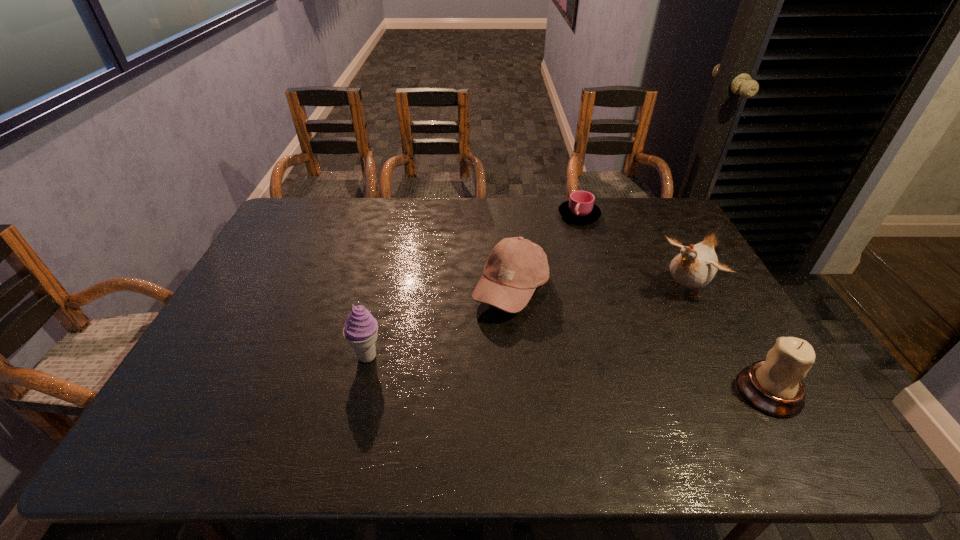
Locate an element on the screen. The height and width of the screenshot is (540, 960). vacant space that satisfies the following two spatial constraints: 1. on the front side of the farthest object; 2. on the right side of the candle holder is located at coordinates (634, 392).

Image resolution: width=960 pixels, height=540 pixels. I want to click on free space that satisfies the following two spatial constraints: 1. on the back side of the farthest object; 2. on the left side of the baseball cap, so click(505, 215).

At what (x,y) coordinates should I click in order to perform the action: click on vacant position in the image that satisfies the following two spatial constraints: 1. on the front side of the farthest object; 2. on the right side of the candle holder. Please return your answer as a coordinate pair (x, y). Image resolution: width=960 pixels, height=540 pixels. Looking at the image, I should click on (634, 392).

Find the location of a particular element. blank space that satisfies the following two spatial constraints: 1. on the back side of the leftmost object; 2. on the right side of the bird is located at coordinates (384, 287).